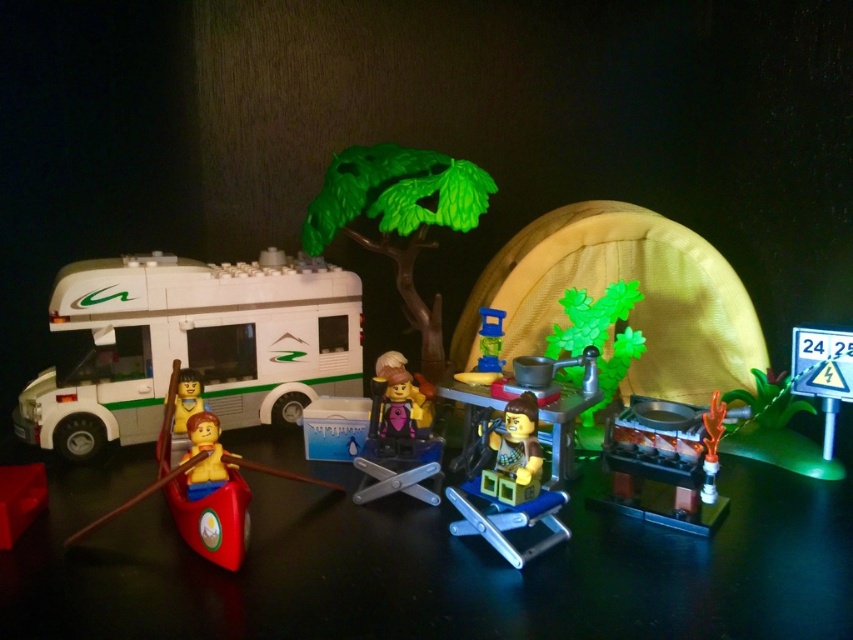
Question: Is purple plastic minifigure at center behind translucent blue plastic cup at center?

Choices:
 (A) no
 (B) yes

Answer: (A)

Question: Which object appears closest to the camera in this image?

Choices:
 (A) smooth plastic table at center
 (B) yellow matte minifigure at center
 (C) smooth plastic figure at center
 (D) green plastic tree at center

Answer: (C)

Question: Is green plastic tree at center wider than green plastic minifigure at center?

Choices:
 (A) no
 (B) yes

Answer: (B)

Question: Is shiny silver stove at lower right below metallic silver tent at center-right?

Choices:
 (A) no
 (B) yes

Answer: (B)

Question: Which object is farther from the camera taking this photo?

Choices:
 (A) shiny silver stove at lower right
 (B) yellow matte minifigure at center
 (C) smooth plastic figure at center
 (D) white plastic recreational vehicle at left

Answer: (D)

Question: Which point is farther to the camera?

Choices:
 (A) translucent blue plastic cup at center
 (B) smooth plastic table at center
 (C) purple plastic minifigure at center

Answer: (A)